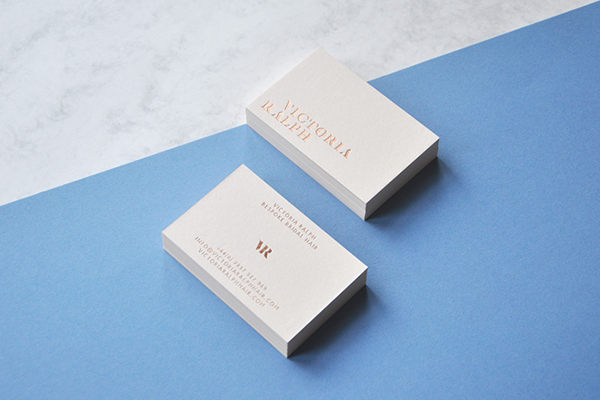
Identify the location of boxes. (387, 136), (326, 278).